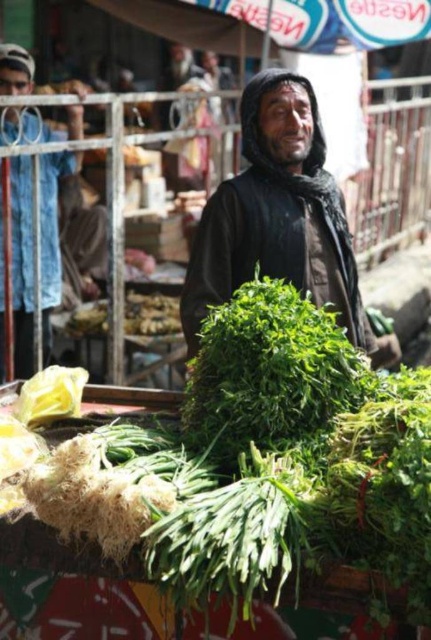
Does dark brown fabric at center appear under blue fabric at left?

Actually, dark brown fabric at center is above blue fabric at left.

Based on the photo, which is below, dark brown fabric at center or blue fabric at left?

blue fabric at left is below.

Does point (209, 248) lie in front of point (56, 280)?

Yes.

The image size is (431, 640). I want to click on dark brown fabric at center, so click(x=278, y=218).